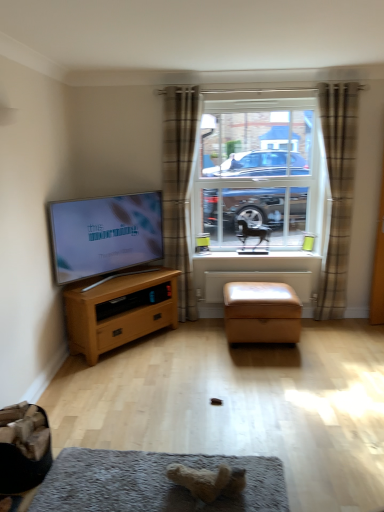
This screenshot has height=512, width=384. Find the location of `vacant space in front of plaid fabric curtain at center, the first curtain viewed from the left`. vacant space in front of plaid fabric curtain at center, the first curtain viewed from the left is located at coordinates (198, 331).